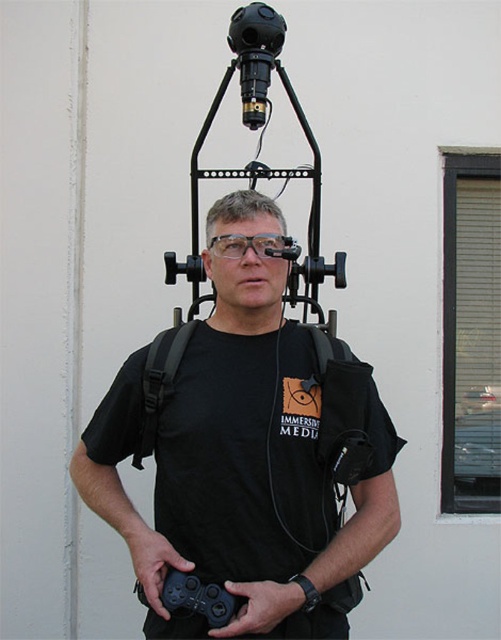
What is the 2D coordinate of the black fabric strap at upper center in the image?

The black fabric strap at upper center is located at the 2D coordinate point of (159, 381).

You are a photographer trying to adjust the 360 camera rig on the person. Which object, the black fabric strap at upper center or the transparent plastic glasses at center, is positioned lower on the person?

The black fabric strap at upper center is located below transparent plastic glasses at center, so the black fabric strap at upper center is positioned lower.